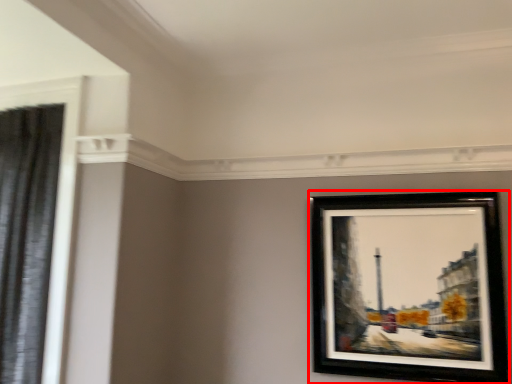
Question: From the image, what is the correct spatial relationship of picture frame (annotated by the red box) in relation to shower curtain?

Choices:
 (A) right
 (B) left

Answer: (A)